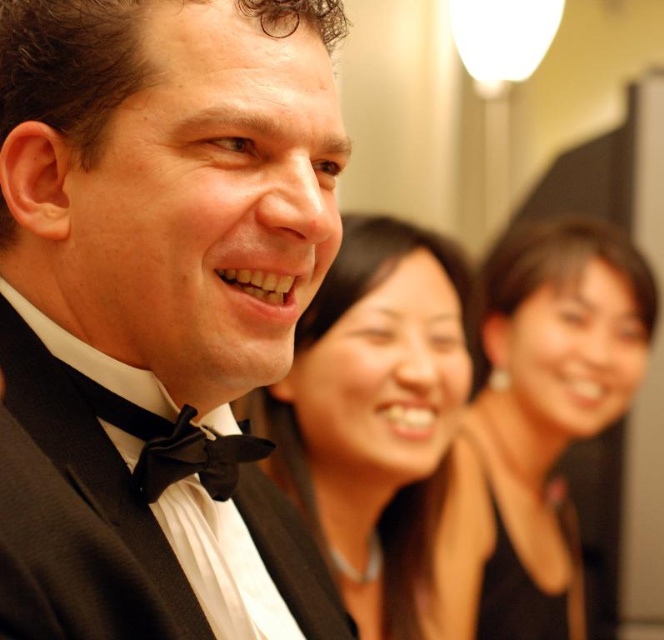
Question: Considering the real-world distances, which object is farthest from the black satin dress at center?

Choices:
 (A) black satin bow tie at lower left
 (B) smooth black hair at center
 (C) black satin tuxedo at center
 (D) matte black dress at center

Answer: (A)

Question: Considering the relative positions of smooth black hair at center and matte black dress at center in the image provided, where is smooth black hair at center located with respect to matte black dress at center?

Choices:
 (A) above
 (B) below

Answer: (A)

Question: Where is smooth black hair at center located in relation to matte black dress at center in the image?

Choices:
 (A) left
 (B) right

Answer: (A)

Question: Which point is closer to the camera taking this photo?

Choices:
 (A) (297, 140)
 (B) (129, 413)
 (C) (355, 344)

Answer: (A)

Question: Which point is closer to the camera taking this photo?

Choices:
 (A) (450, 564)
 (B) (596, 397)
 (C) (418, 484)

Answer: (C)

Question: Does black satin tuxedo at center appear on the right side of black satin dress at center?

Choices:
 (A) yes
 (B) no

Answer: (B)